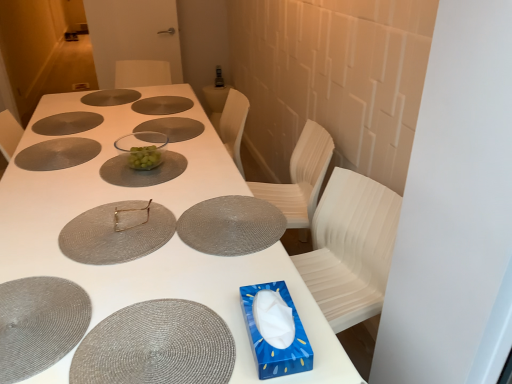
The width and height of the screenshot is (512, 384). What are the coordinates of `vacant region below transparent glass bowl at center, which is the fourth glass plate from front to back (from a real-world perspective)` in the screenshot? It's located at (145, 172).